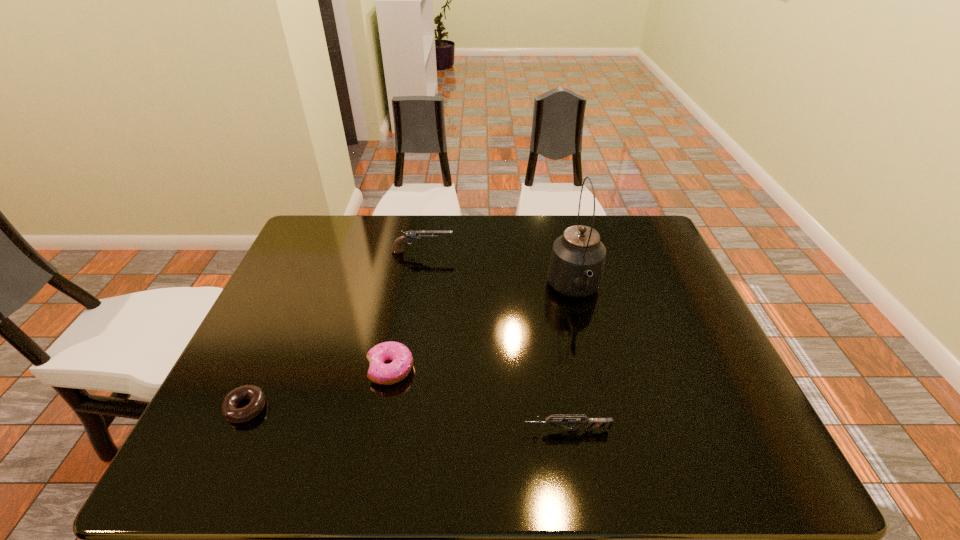
What are the coordinates of `kettle` in the screenshot? It's located at (576, 266).

What are the coordinates of `the fourth nearest object` in the screenshot? It's located at (576, 266).

Identify the location of the second tallest object. (408, 236).

Where is `the left gun`? Image resolution: width=960 pixels, height=540 pixels. the left gun is located at coordinates (408, 236).

Find the location of a particular element. This screenshot has height=540, width=960. the nearer gun is located at coordinates (590, 423).

Locate an element on the screen. Image resolution: width=960 pixels, height=540 pixels. the right gun is located at coordinates 590,423.

This screenshot has width=960, height=540. What are the coordinates of `the right doughnut` in the screenshot? It's located at (402, 360).

This screenshot has width=960, height=540. Identify the location of the farther doughnut. (402, 360).

Image resolution: width=960 pixels, height=540 pixels. I want to click on the left doughnut, so click(x=230, y=411).

The image size is (960, 540). In order to click on the leftmost object in this screenshot , I will do `click(230, 411)`.